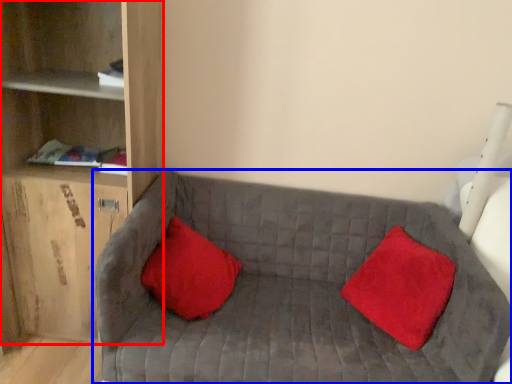
Question: Among these objects, which one is farthest to the camera, shelf (highlighted by a red box) or studio couch (highlighted by a blue box)?

Choices:
 (A) shelf
 (B) studio couch

Answer: (A)